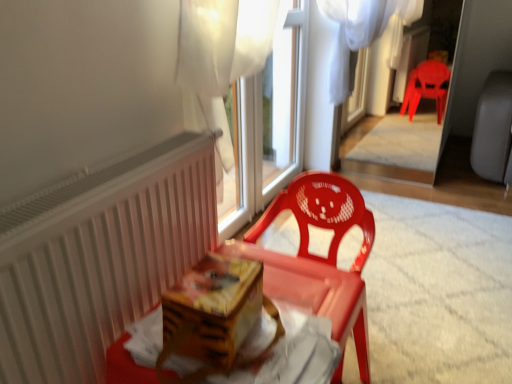
You are a GUI agent. You are given a task and a screenshot of the screen. Output one action in this format:
    pyautogui.click(x=<x>, y=<y>)
    Task: Click on the white plastic window frame at upper center
    Image resolution: width=512 pixels, height=384 pixels.
    Given the screenshot: What is the action you would take?
    pyautogui.click(x=281, y=105)

This screenshot has width=512, height=384. Describe the element at coordinates (281, 105) in the screenshot. I see `white plastic window frame at upper center` at that location.

The width and height of the screenshot is (512, 384). Describe the element at coordinates (323, 257) in the screenshot. I see `matte plastic chair at center` at that location.

The width and height of the screenshot is (512, 384). What do you see at coordinates (225, 41) in the screenshot?
I see `white sheer curtain at upper center` at bounding box center [225, 41].

Locate an element on the screen. wooden at center is located at coordinates (316, 293).

Are white sheer curtain at upper center and wooden at center far apart?

No, white sheer curtain at upper center is in close proximity to wooden at center.

Based on the photo, considering the sizes of objects white sheer curtain at upper center and wooden at center in the image provided, who is shorter, white sheer curtain at upper center or wooden at center?

Standing shorter between the two is wooden at center.

Is white sheer curtain at upper center situated inside wooden at center or outside?

white sheer curtain at upper center is not enclosed by wooden at center.

Which of these two, white sheer curtain at upper center or wooden at center, is wider?

With larger width is wooden at center.

Is white plastic window frame at upper center far away from matte plastic chair at center?

That's right, there is a large distance between white plastic window frame at upper center and matte plastic chair at center.

Which is in front, white plastic window frame at upper center or matte plastic chair at center?

matte plastic chair at center is in front.

Considering the sizes of objects white plastic window frame at upper center and matte plastic chair at center in the image provided, who is thinner, white plastic window frame at upper center or matte plastic chair at center?

white plastic window frame at upper center.

Locate an element on the screen. chair on the left of white plastic window frame at upper center is located at coordinates (323, 257).

Considering the sizes of matte plastic chair at center and white plastic window frame at upper center in the image, is matte plastic chair at center wider or thinner than white plastic window frame at upper center?

Clearly, matte plastic chair at center has more width compared to white plastic window frame at upper center.

From a real-world perspective, is matte plastic chair at center beneath white plastic window frame at upper center?

Indeed, from a real-world perspective, matte plastic chair at center is positioned beneath white plastic window frame at upper center.

Is point (287, 191) closer to camera compared to point (305, 82)?

Yes, it is.

How much distance is there between matte plastic chair at center and white plastic window frame at upper center?

matte plastic chair at center and white plastic window frame at upper center are 3.48 feet apart from each other.

Is white plastic window frame at upper center situated inside white sheer curtain at upper center or outside?

The correct answer is: inside.

Which is closer, (302,118) or (181,18)?

Point (302,118) is positioned farther from the camera compared to point (181,18).

Consider the image. Can you confirm if white plastic window frame at upper center is positioned to the right of white sheer curtain at upper center?

Yes.

How different are the orientations of wooden at center and white matte radiator at left in degrees?

The angle between the facing direction of wooden at center and the facing direction of white matte radiator at left is 0.223 degrees.

Considering the relative sizes of wooden at center and white matte radiator at left in the image provided, is wooden at center taller than white matte radiator at left?

No.

Is point (120, 366) closer to camera compared to point (45, 278)?

No, (120, 366) is behind (45, 278).

Considering the relative positions of wooden at center and white matte radiator at left in the image provided, is wooden at center to the right of white matte radiator at left from the viewer's perspective?

Yes, wooden at center is to the right of white matte radiator at left.

Could you tell me if white matte radiator at left is facing wooden at center?

Yes, white matte radiator at left is facing wooden at center.

From the image's perspective, which one is positioned lower, white matte radiator at left or wooden at center?

wooden at center appears lower in the image.

Considering the sizes of objects white matte radiator at left and wooden at center in the image provided, who is bigger, white matte radiator at left or wooden at center?

white matte radiator at left.

From their relative heights in the image, would you say white matte radiator at left is taller or shorter than wooden at center?

Answer: Clearly, white matte radiator at left is taller compared to wooden at center.

From a real-world perspective, is white matte radiator at left below matte plastic chair at center?

Incorrect, from a real-world perspective, white matte radiator at left is higher than matte plastic chair at center.

Is white matte radiator at left taller or shorter than matte plastic chair at center?

In the image, white matte radiator at left appears to be taller than matte plastic chair at center.

Does white matte radiator at left appear on the right side of matte plastic chair at center?

No.

In order to click on chair below the white matte radiator at left (from the image's perspective) in this screenshot , I will do `click(323, 257)`.

The width and height of the screenshot is (512, 384). In order to click on curtain that appears on the right of wooden at center in this screenshot , I will do `click(225, 41)`.

The image size is (512, 384). I want to click on chair that is below the white plastic window frame at upper center (from the image's perspective), so click(323, 257).

When comparing their distances from wooden at center, does white sheer curtain at upper center or white plastic window frame at upper center seem closer?

white sheer curtain at upper center is positioned closer to the anchor wooden at center.

When comparing their distances from white matte radiator at left, does white sheer curtain at upper center or matte plastic chair at center seem closer?

The object closer to white matte radiator at left is matte plastic chair at center.

Estimate the real-world distances between objects in this image. Which object is further from wooden at center, white plastic window frame at upper center or white sheer curtain at upper center?

white plastic window frame at upper center is further to wooden at center.

Considering their positions, is matte plastic chair at center positioned closer to white sheer curtain at upper center than white matte radiator at left?

Based on the image, white matte radiator at left appears to be nearer to white sheer curtain at upper center.

When comparing their distances from white matte radiator at left, does white sheer curtain at upper center or wooden at center seem closer?

wooden at center is positioned closer to the anchor white matte radiator at left.

Looking at the image, which one is located closer to white plastic window frame at upper center, white sheer curtain at upper center or white matte radiator at left?

white sheer curtain at upper center.

Considering their positions, is matte plastic chair at center positioned further to white plastic window frame at upper center than white matte radiator at left?

white matte radiator at left is further to white plastic window frame at upper center.

Which object lies further to the anchor point matte plastic chair at center, white plastic window frame at upper center or white sheer curtain at upper center?

Among the two, white plastic window frame at upper center is located further to matte plastic chair at center.

Where is `chair positioned between wooden at center and white sheer curtain at upper center from near to far`? This screenshot has height=384, width=512. chair positioned between wooden at center and white sheer curtain at upper center from near to far is located at coordinates (323, 257).

What are the coordinates of `table between white matte radiator at left and white plastic window frame at upper center along the z-axis` in the screenshot? It's located at (316, 293).

Identify the location of table between white matte radiator at left and white sheer curtain at upper center from front to back. (316, 293).

In order to click on chair between wooden at center and white plastic window frame at upper center in the front-back direction in this screenshot , I will do `click(323, 257)`.